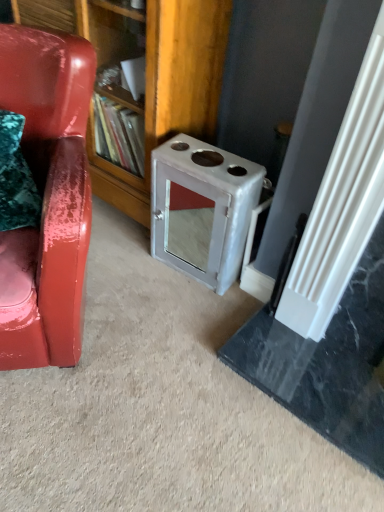
Question: Considering the relative sizes of wooden bookshelf at center and glossy leather chair at left in the image provided, is wooden bookshelf at center thinner than glossy leather chair at left?

Choices:
 (A) yes
 (B) no

Answer: (A)

Question: Is wooden bookshelf at center oriented towards glossy leather chair at left?

Choices:
 (A) yes
 (B) no

Answer: (A)

Question: Is wooden bookshelf at center positioned with its back to glossy leather chair at left?

Choices:
 (A) yes
 (B) no

Answer: (B)

Question: Does wooden bookshelf at center come in front of glossy leather chair at left?

Choices:
 (A) no
 (B) yes

Answer: (A)

Question: Would you say wooden bookshelf at center contains glossy leather chair at left?

Choices:
 (A) no
 (B) yes

Answer: (A)

Question: Considering the positions of glossy leather chair at left and wooden bookshelf at center in the image, is glossy leather chair at left bigger or smaller than wooden bookshelf at center?

Choices:
 (A) small
 (B) big

Answer: (A)

Question: From a real-world perspective, is glossy leather chair at left positioned above or below wooden bookshelf at center?

Choices:
 (A) below
 (B) above

Answer: (A)

Question: Is glossy leather chair at left inside the boundaries of wooden bookshelf at center, or outside?

Choices:
 (A) inside
 (B) outside

Answer: (B)

Question: Considering the positions of point (31, 80) and point (216, 74), is point (31, 80) closer or farther from the camera than point (216, 74)?

Choices:
 (A) closer
 (B) farther

Answer: (A)

Question: Is metallic gray stove at center-right situated inside glossy leather chair at left or outside?

Choices:
 (A) inside
 (B) outside

Answer: (B)

Question: Is metallic gray stove at center-right in front of or behind glossy leather chair at left in the image?

Choices:
 (A) behind
 (B) front

Answer: (A)

Question: Considering the positions of metallic gray stove at center-right and glossy leather chair at left in the image, is metallic gray stove at center-right taller or shorter than glossy leather chair at left?

Choices:
 (A) short
 (B) tall

Answer: (A)

Question: Would you say metallic gray stove at center-right is to the left or to the right of glossy leather chair at left in the picture?

Choices:
 (A) right
 (B) left

Answer: (A)

Question: Relative to metallic gray stove at center-right, is wooden bookshelf at center in front or behind?

Choices:
 (A) behind
 (B) front

Answer: (B)

Question: Is wooden bookshelf at center inside the boundaries of metallic gray stove at center-right, or outside?

Choices:
 (A) inside
 (B) outside

Answer: (B)